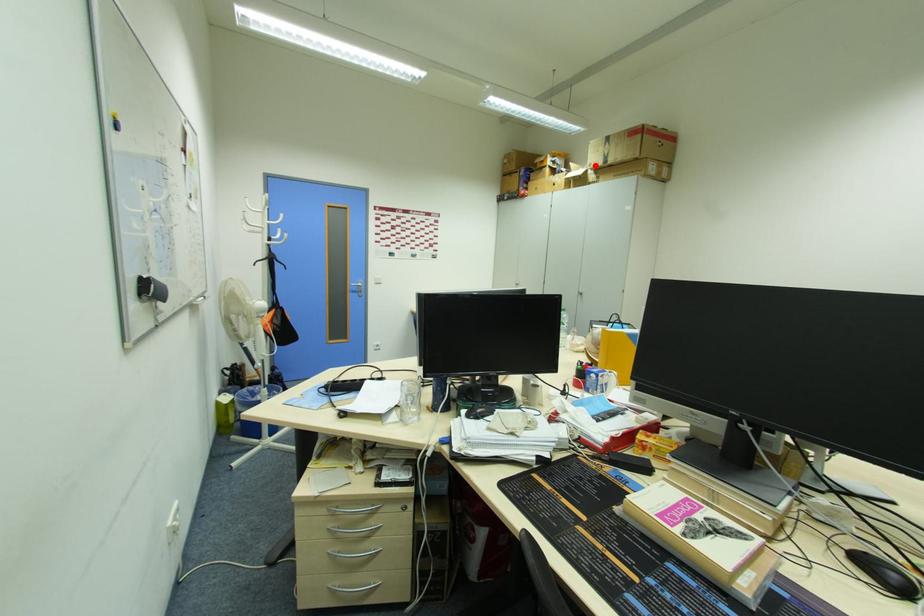
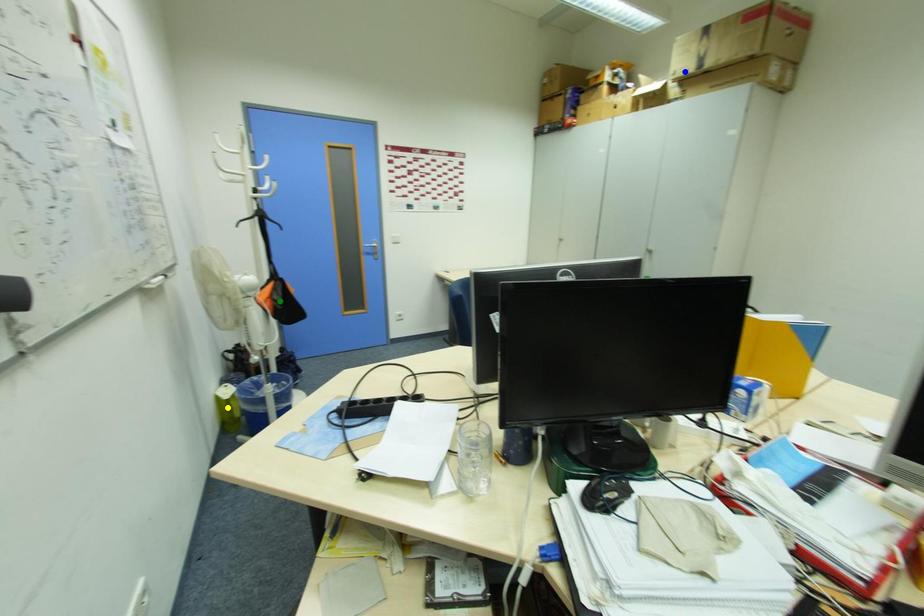
Question: I am providing you with two images of the same scene from different viewpoints. A red point is marked on the first image. You are given multiple points on the second image. Which point in image 2 is actually the same real-world point as the red point in image 1?

Choices:
 (A) green point
 (B) blue point
 (C) yellow point

Answer: (B)